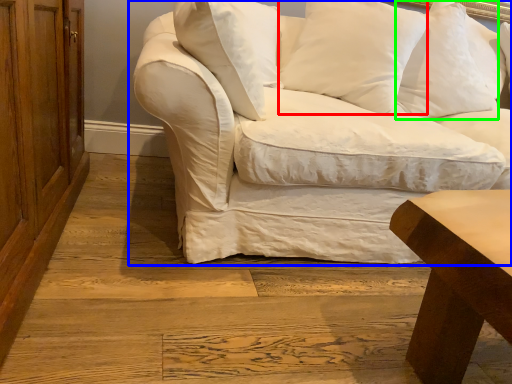
Question: Which object is the farthest from pillow (highlighted by a red box)? Choose among these: studio couch (highlighted by a blue box) or pillow (highlighted by a green box).

Choices:
 (A) studio couch
 (B) pillow

Answer: (B)